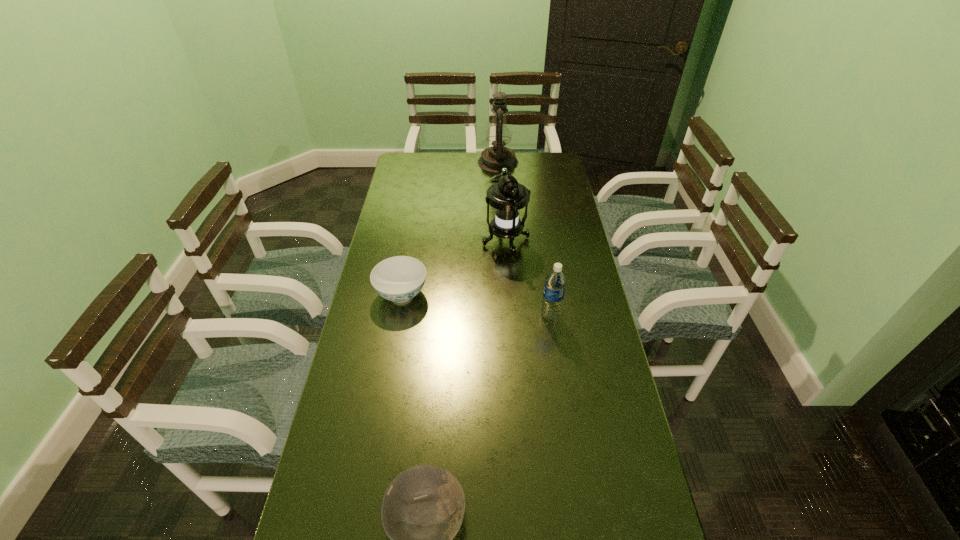
Locate an element on the screen. This screenshot has width=960, height=540. free space that is in between the water bottle and the oil lamp is located at coordinates (524, 239).

Find the location of a particular element. Image resolution: width=960 pixels, height=540 pixels. the closest object to the water bottle is located at coordinates (507, 196).

Choose which object is the fourth nearest neighbor to the nearest object. Please provide its 2D coordinates. Your answer should be formatted as a tuple, i.e. [(x, y)], where the tuple contains the x and y coordinates of a point satisfying the conditions above.

[(493, 159)]